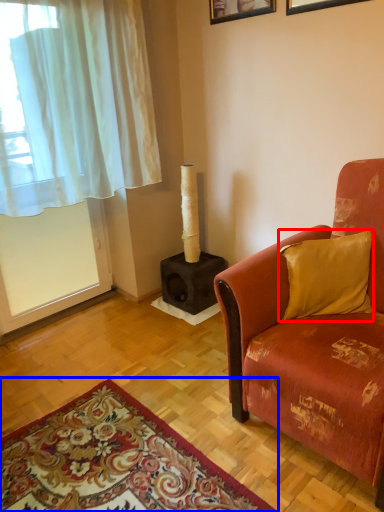
Question: Among these objects, which one is farthest to the camera, pillow (highlighted by a red box) or mat (highlighted by a blue box)?

Choices:
 (A) pillow
 (B) mat

Answer: (A)